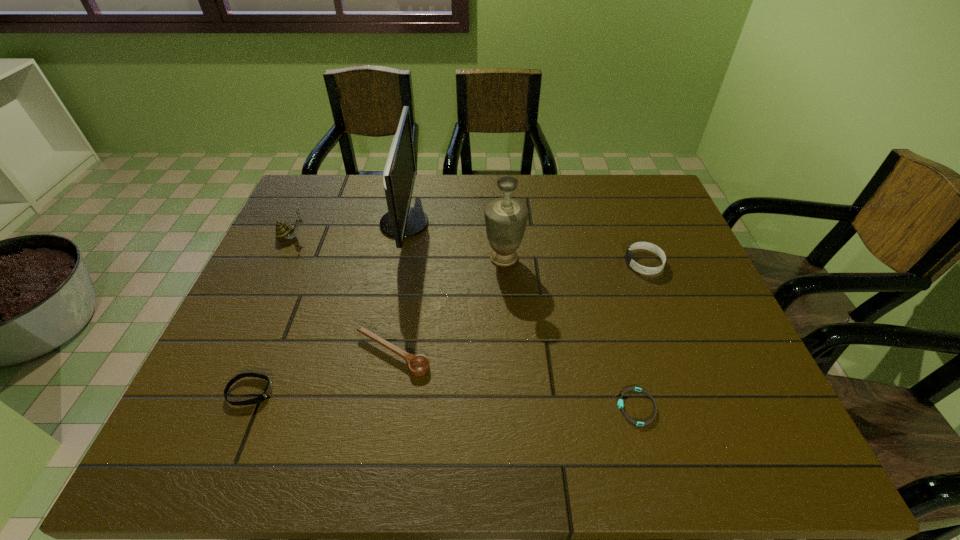
In order to click on vacant point located between the sixth shortest object and the third nearest object in this screenshot , I will do [448, 306].

Identify the location of vacant region between the second object from right to left and the leftmost wristband. (444, 400).

What are the coordinates of `unoccupied position between the leftmost wristband and the fifth shortest object` in the screenshot? It's located at (272, 314).

Identify which object is located as the sixth nearest to the farthest wristband. Please provide its 2D coordinates. Your answer should be formatted as a tuple, i.e. [(x, y)], where the tuple contains the x and y coordinates of a point satisfying the conditions above.

[(283, 230)]

Select which object appears as the third closest to the snail. Please provide its 2D coordinates. Your answer should be formatted as a tuple, i.e. [(x, y)], where the tuple contains the x and y coordinates of a point satisfying the conditions above.

[(268, 389)]

Choose which wristband is the nearest neighbor to the fifth shortest object. Please provide its 2D coordinates. Your answer should be formatted as a tuple, i.e. [(x, y)], where the tuple contains the x and y coordinates of a point satisfying the conditions above.

[(268, 389)]

Identify which wristband is located as the third nearest to the fifth farthest object. Please provide its 2D coordinates. Your answer should be formatted as a tuple, i.e. [(x, y)], where the tuple contains the x and y coordinates of a point satisfying the conditions above.

[(629, 257)]

You are a GUI agent. You are given a task and a screenshot of the screen. Output one action in this format:
    pyautogui.click(x=<x>, y=<y>)
    Task: Click on the vacant position in the image that satisfies the following two spatial constraints: 1. on the screen side of the fifth farthest object; 2. on the left side of the monitor
    
    Given the screenshot: What is the action you would take?
    pyautogui.click(x=379, y=354)

Locate an element on the screen. The image size is (960, 540). free point that satisfies the following two spatial constraints: 1. on the face of the third nearest object; 2. on the left side of the third tallest object is located at coordinates (238, 354).

Identify the location of free space that satisfies the following two spatial constraints: 1. on the face of the fifth shortest object; 2. on the back side of the sixth shortest object. (283, 258).